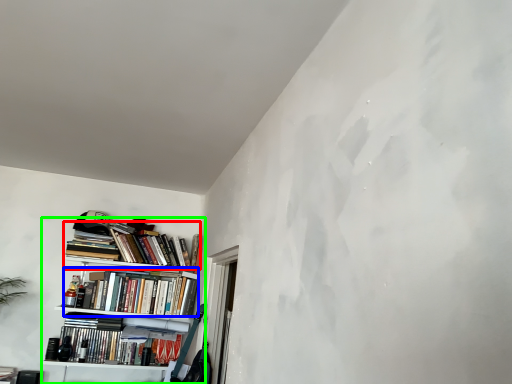
Question: Based on their relative distances, which object is farther from book (highlighted by a red box)? Choose from book (highlighted by a blue box) and bookcase (highlighted by a green box).

Choices:
 (A) book
 (B) bookcase

Answer: (A)